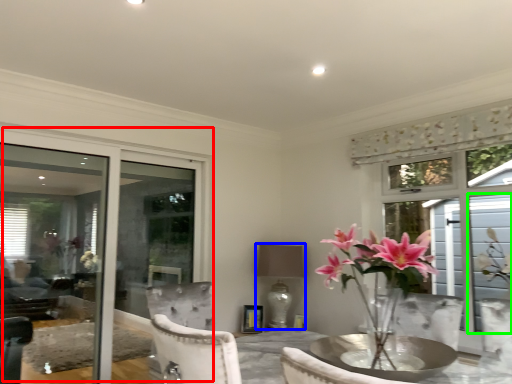
Question: Which object is the farthest from window (highlighted by a red box)? Choose among these: lamp (highlighted by a blue box) or window screen (highlighted by a green box).

Choices:
 (A) lamp
 (B) window screen

Answer: (B)